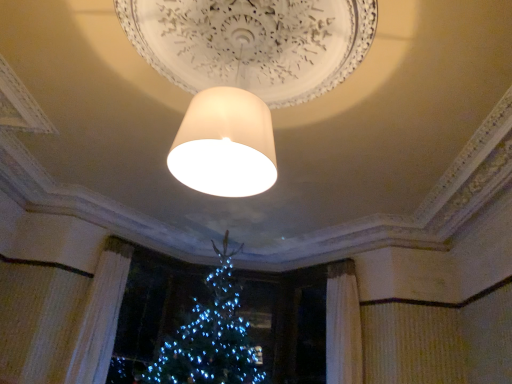
Question: From a real-world perspective, is white textured curtain at lower left above or below matte white lampshade at center?

Choices:
 (A) above
 (B) below

Answer: (B)

Question: From their relative heights in the image, would you say white textured curtain at lower left is taller or shorter than matte white lampshade at center?

Choices:
 (A) short
 (B) tall

Answer: (B)

Question: Is point (118, 292) positioned closer to the camera than point (209, 129)?

Choices:
 (A) farther
 (B) closer

Answer: (A)

Question: Based on their sizes in the image, would you say matte white lampshade at center is bigger or smaller than white textured curtain at lower left?

Choices:
 (A) big
 (B) small

Answer: (A)

Question: Considering the positions of matte white lampshade at center and white textured curtain at lower left in the image, is matte white lampshade at center taller or shorter than white textured curtain at lower left?

Choices:
 (A) tall
 (B) short

Answer: (B)

Question: Do you think matte white lampshade at center is within white textured curtain at lower left, or outside of it?

Choices:
 (A) inside
 (B) outside

Answer: (B)

Question: Does point (366, 49) appear closer or farther from the camera than point (102, 360)?

Choices:
 (A) farther
 (B) closer

Answer: (B)